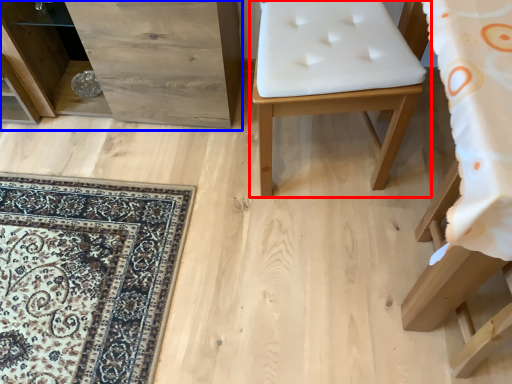
Question: Which of the following is the farthest to the observer, furniture (highlighted by a red box) or dresser (highlighted by a blue box)?

Choices:
 (A) furniture
 (B) dresser

Answer: (B)